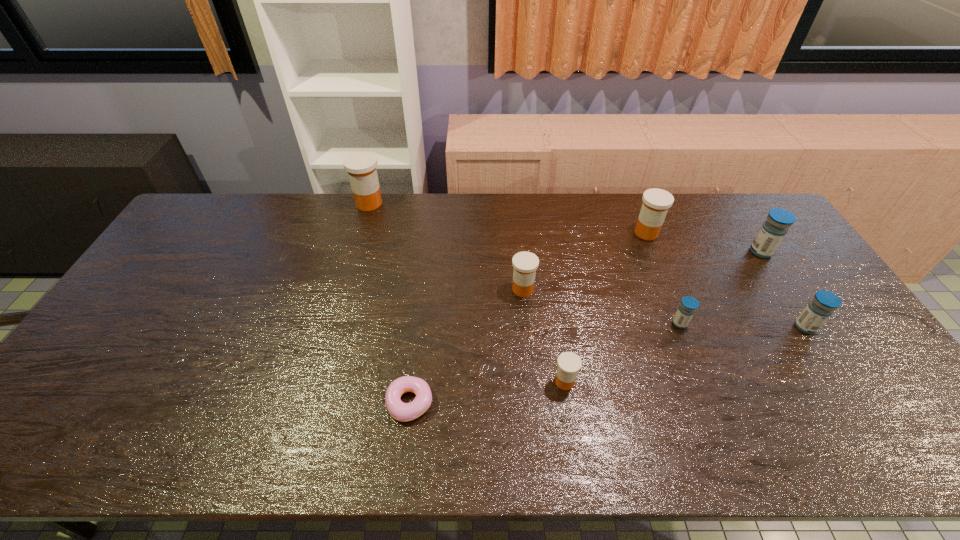
Locate an element on the screen. Image resolution: width=960 pixels, height=540 pixels. vacant region between the smallest blue medicine and the second smallest blue medicine is located at coordinates (742, 325).

Where is `vacant area that lies between the farthest object and the doughnut`? Image resolution: width=960 pixels, height=540 pixels. vacant area that lies between the farthest object and the doughnut is located at coordinates (390, 303).

At what (x,y) coordinates should I click in order to perform the action: click on object that is the fourth closest to the biggest blue medicine. Please return your answer as a coordinate pair (x, y). Looking at the image, I should click on (525, 264).

Identify the location of object that is the closest to the second smallest orange medicine. (569, 363).

At what (x,y) coordinates should I click in order to perform the action: click on medicine that stands as the fifth closest to the second biggest blue medicine. Please return your answer as a coordinate pair (x, y). The height and width of the screenshot is (540, 960). Looking at the image, I should click on (525, 264).

Identify which medicine is the fifth nearest to the second smallest blue medicine. Please provide its 2D coordinates. Your answer should be formatted as a tuple, i.e. [(x, y)], where the tuple contains the x and y coordinates of a point satisfying the conditions above.

[(525, 264)]

Identify which orange medicine is located as the nearest to the second smallest blue medicine. Please provide its 2D coordinates. Your answer should be formatted as a tuple, i.e. [(x, y)], where the tuple contains the x and y coordinates of a point satisfying the conditions above.

[(656, 202)]

Identify which orange medicine is the second nearest to the fourth farthest object. Please provide its 2D coordinates. Your answer should be formatted as a tuple, i.e. [(x, y)], where the tuple contains the x and y coordinates of a point satisfying the conditions above.

[(656, 202)]

Identify which blue medicine is located as the second nearest to the fifth nearest medicine. Please provide its 2D coordinates. Your answer should be formatted as a tuple, i.e. [(x, y)], where the tuple contains the x and y coordinates of a point satisfying the conditions above.

[(686, 310)]

Locate an element on the screen. Image resolution: width=960 pixels, height=540 pixels. blue medicine object that ranks as the closest to the second smallest orange medicine is located at coordinates (686, 310).